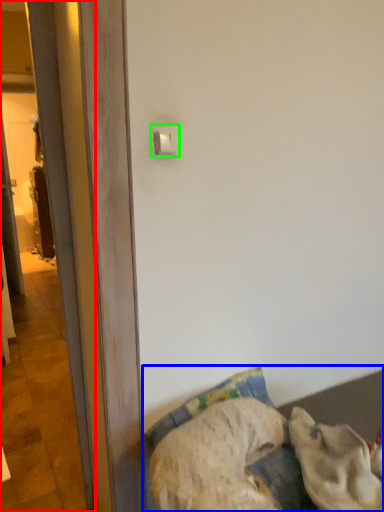
Question: Considering the real-world distances, which object is farthest from screen door (highlighted by a red box)? furniture (highlighted by a blue box) or light switch (highlighted by a green box)?

Choices:
 (A) furniture
 (B) light switch

Answer: (A)